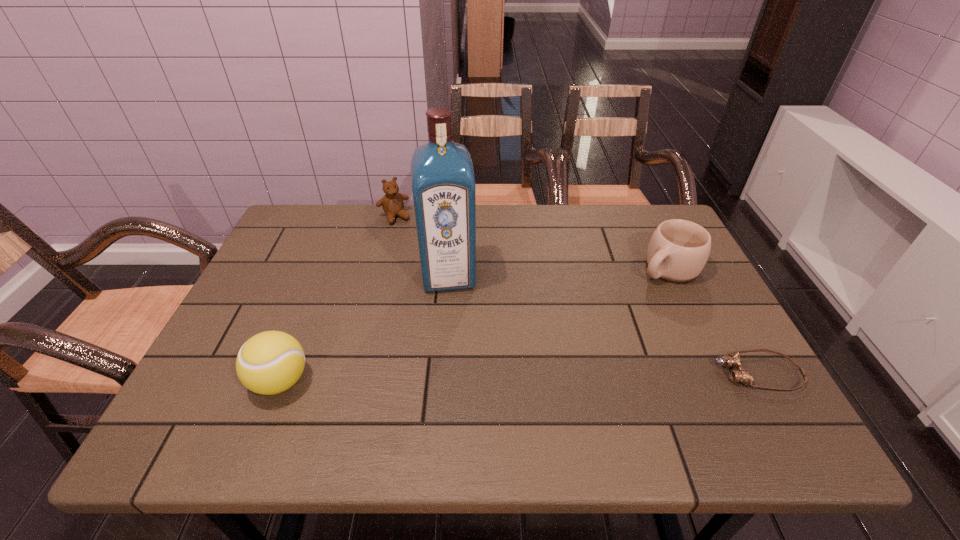
Identify the location of blank area located 0.140m on the front lenses and sides of the goggles. The width and height of the screenshot is (960, 540). (651, 373).

You are a GUI agent. You are given a task and a screenshot of the screen. Output one action in this format:
    pyautogui.click(x=<x>, y=<y>)
    Task: Click on the free space located on the side of the mug with the handle
    Image resolution: width=960 pixels, height=540 pixels.
    Given the screenshot: What is the action you would take?
    pyautogui.click(x=617, y=301)

The image size is (960, 540). I want to click on vacant space located on the side of the mug with the handle, so click(x=610, y=306).

Image resolution: width=960 pixels, height=540 pixels. Identify the location of free space located on the side of the mug with the handle. (632, 291).

Locate an element on the screen. blank area located 0.210m on the flat label side of the liquor is located at coordinates tap(458, 360).

At what (x,y) coordinates should I click in order to perform the action: click on vacant space situated 0.090m on the flat label side of the liquor. Please return your answer as a coordinate pair (x, y). Looking at the image, I should click on (453, 320).

Where is `vacant space situated on the flat label side of the liquor`? Image resolution: width=960 pixels, height=540 pixels. vacant space situated on the flat label side of the liquor is located at coordinates (455, 336).

What are the coordinates of `vacant space located on the front-facing side of the fourth object from right to left` in the screenshot? It's located at (431, 278).

At what (x,y) coordinates should I click in order to perform the action: click on vacant space located 0.200m on the front-facing side of the fourth object from right to left. Please return your answer as a coordinate pair (x, y). Image resolution: width=960 pixels, height=540 pixels. Looking at the image, I should click on (422, 262).

Where is `vacant space located 0.200m on the front-facing side of the fourth object from right to left`? The height and width of the screenshot is (540, 960). vacant space located 0.200m on the front-facing side of the fourth object from right to left is located at coordinates (422, 262).